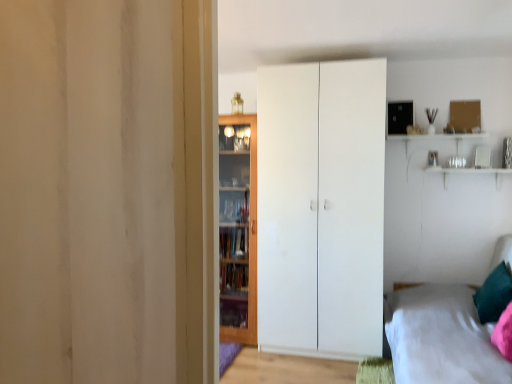
Question: Is white fabric bed at lower right at the right side of teal velvet pillow at lower right?

Choices:
 (A) no
 (B) yes

Answer: (A)

Question: Is white fabric bed at lower right at the left side of teal velvet pillow at lower right?

Choices:
 (A) yes
 (B) no

Answer: (A)

Question: From the image's perspective, is white fabric bed at lower right located beneath teal velvet pillow at lower right?

Choices:
 (A) yes
 (B) no

Answer: (A)

Question: Considering the relative sizes of white fabric bed at lower right and teal velvet pillow at lower right in the image provided, is white fabric bed at lower right taller than teal velvet pillow at lower right?

Choices:
 (A) no
 (B) yes

Answer: (B)

Question: Is white fabric bed at lower right shorter than teal velvet pillow at lower right?

Choices:
 (A) no
 (B) yes

Answer: (A)

Question: Considering the positions of point (486, 284) and point (501, 367), is point (486, 284) closer or farther from the camera than point (501, 367)?

Choices:
 (A) closer
 (B) farther

Answer: (B)

Question: Considering the positions of teal velvet pillow at lower right and white fabric bed at lower right in the image, is teal velvet pillow at lower right wider or thinner than white fabric bed at lower right?

Choices:
 (A) thin
 (B) wide

Answer: (A)

Question: Visually, is teal velvet pillow at lower right positioned to the left or to the right of white fabric bed at lower right?

Choices:
 (A) right
 (B) left

Answer: (A)

Question: Is teal velvet pillow at lower right taller or shorter than white fabric bed at lower right?

Choices:
 (A) tall
 (B) short

Answer: (B)

Question: Is wooden cabinet at center wider or thinner than teal velvet pillow at lower right?

Choices:
 (A) thin
 (B) wide

Answer: (B)

Question: Would you say wooden cabinet at center is inside or outside teal velvet pillow at lower right?

Choices:
 (A) inside
 (B) outside

Answer: (B)

Question: From their relative heights in the image, would you say wooden cabinet at center is taller or shorter than teal velvet pillow at lower right?

Choices:
 (A) tall
 (B) short

Answer: (A)

Question: Is wooden cabinet at center bigger or smaller than teal velvet pillow at lower right?

Choices:
 (A) small
 (B) big

Answer: (B)

Question: From a real-world perspective, is teal velvet pillow at lower right physically located above or below white matte wardrobe at center?

Choices:
 (A) below
 (B) above

Answer: (A)

Question: Is teal velvet pillow at lower right inside the boundaries of white matte wardrobe at center, or outside?

Choices:
 (A) inside
 (B) outside

Answer: (B)